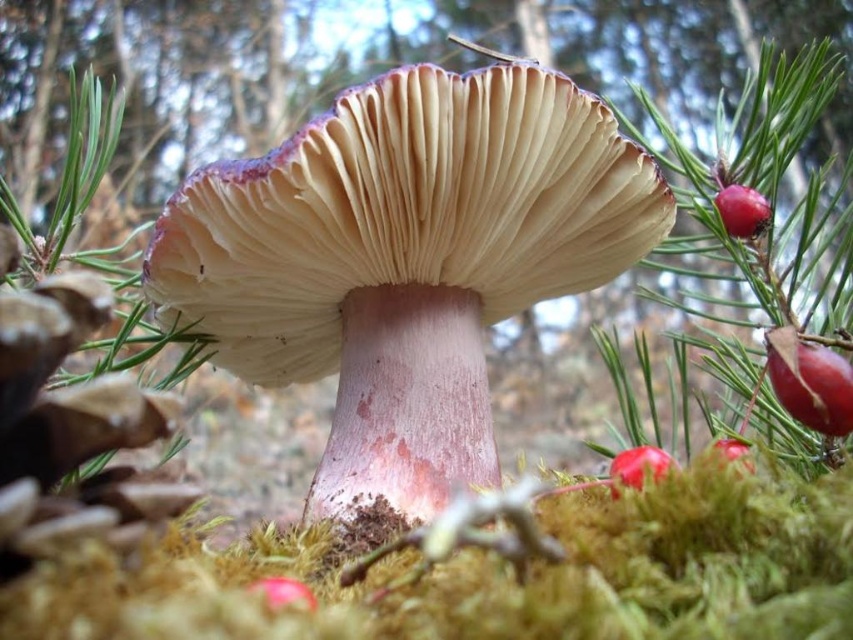
You are examining the mushroom and berries in the image. There are two points marked on the image. Which point, point (662, 477) or point (741, 451), is closer to you?

Point (662, 477) is closer to the viewer than point (741, 451).

You are a forager in the forest and want to pick the tallest glossy red berry. Which one should you choose between the glossy red berry at upper right and the glossy red berry at center right?

The glossy red berry at upper right is taller than the glossy red berry at center right, so you should choose the glossy red berry at upper right.